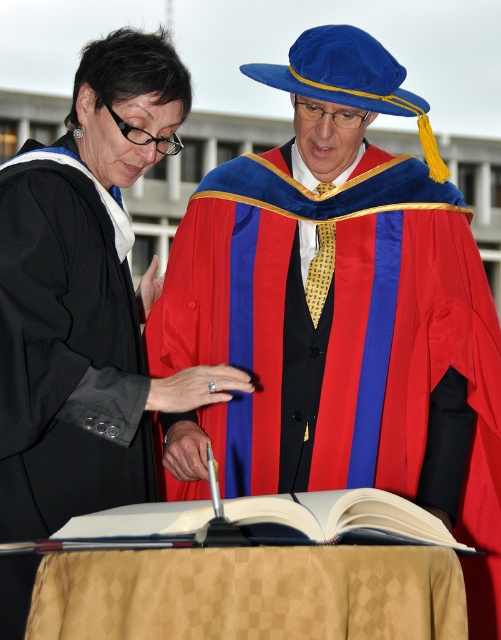
Question: Can you confirm if velvet blue graduation gown at center is bigger than matte black robe at left?

Choices:
 (A) no
 (B) yes

Answer: (B)

Question: Which of the following is the farthest from the observer?

Choices:
 (A) velvet blue graduation gown at center
 (B) matte black robe at left

Answer: (A)

Question: Which of the following is the farthest from the observer?

Choices:
 (A) (367, 538)
 (B) (379, 93)
 (C) (74, 256)

Answer: (B)

Question: Can you confirm if velvet blue graduation gown at center is smaller than matte black robe at left?

Choices:
 (A) no
 (B) yes

Answer: (A)

Question: Does matte black robe at left appear on the right side of white paper book at center?

Choices:
 (A) no
 (B) yes

Answer: (A)

Question: Which of the following is the closest to the observer?

Choices:
 (A) (231, 513)
 (B) (119, 381)
 (C) (300, 433)

Answer: (A)